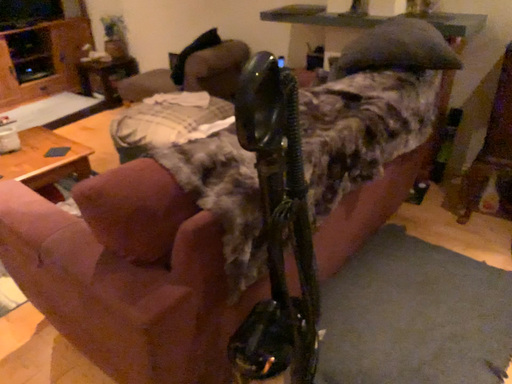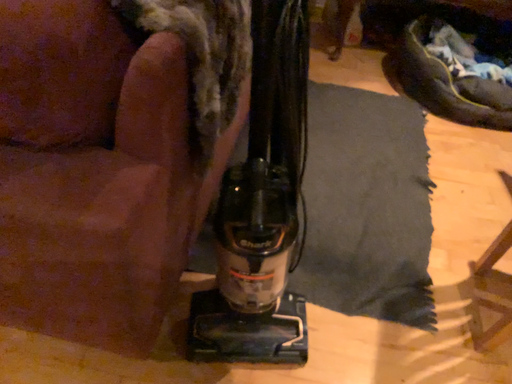
Question: How did the camera likely rotate when shooting the video?

Choices:
 (A) rotated downward
 (B) rotated upward

Answer: (A)